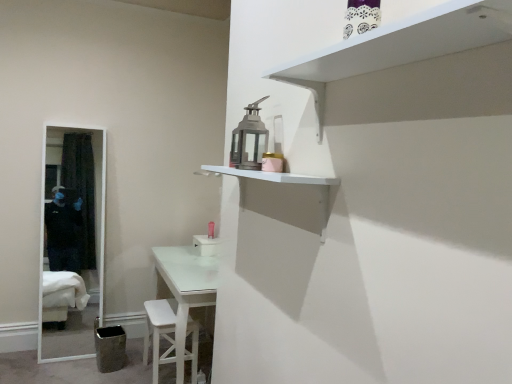
Question: Is white matte shelf at upper right, acting as the second shelf starting from the bottom, positioned in front of pink matte toiletry at center?

Choices:
 (A) yes
 (B) no

Answer: (A)

Question: Can you confirm if white matte shelf at upper right, which is the 1th shelf in top-to-bottom order, is taller than pink matte toiletry at center?

Choices:
 (A) no
 (B) yes

Answer: (B)

Question: Considering the relative sizes of white matte shelf at upper right, acting as the second shelf starting from the bottom, and pink matte toiletry at center in the image provided, is white matte shelf at upper right, acting as the second shelf starting from the bottom, wider than pink matte toiletry at center?

Choices:
 (A) yes
 (B) no

Answer: (A)

Question: From the image's perspective, is white matte shelf at upper right, acting as the second shelf starting from the bottom, located beneath pink matte toiletry at center?

Choices:
 (A) no
 (B) yes

Answer: (A)

Question: Can you confirm if white matte shelf at upper right, which is the 1th shelf in top-to-bottom order, is bigger than pink matte toiletry at center?

Choices:
 (A) no
 (B) yes

Answer: (B)

Question: Considering the positions of point (307, 59) and point (200, 170), is point (307, 59) closer or farther from the camera than point (200, 170)?

Choices:
 (A) farther
 (B) closer

Answer: (B)

Question: Would you say white matte shelf at upper right, acting as the second shelf starting from the bottom, is inside or outside white matte shelf at upper center, placed as the second shelf when sorted from top to bottom?

Choices:
 (A) outside
 (B) inside

Answer: (A)

Question: From the image's perspective, relative to white matte shelf at upper center, placed as the 1th shelf when sorted from bottom to top, is white matte shelf at upper right, which is the 1th shelf in top-to-bottom order, above or below?

Choices:
 (A) above
 (B) below

Answer: (A)

Question: Considering the positions of white matte shelf at upper right, which is the 1th shelf in top-to-bottom order, and white matte shelf at upper center, placed as the second shelf when sorted from top to bottom, in the image, is white matte shelf at upper right, which is the 1th shelf in top-to-bottom order, taller or shorter than white matte shelf at upper center, placed as the second shelf when sorted from top to bottom,?

Choices:
 (A) short
 (B) tall

Answer: (A)

Question: Is pink matte toiletry at center spatially inside white wooden stool at lower center, or outside of it?

Choices:
 (A) inside
 (B) outside

Answer: (B)

Question: From the image's perspective, relative to white wooden stool at lower center, is pink matte toiletry at center above or below?

Choices:
 (A) below
 (B) above

Answer: (B)

Question: Is point (212, 223) closer or farther from the camera than point (164, 332)?

Choices:
 (A) closer
 (B) farther

Answer: (B)

Question: Is pink matte toiletry at center wider or thinner than white wooden stool at lower center?

Choices:
 (A) thin
 (B) wide

Answer: (A)

Question: Is pink matte toiletry at center bigger or smaller than white matte shelf at upper right, which is the 1th shelf in top-to-bottom order?

Choices:
 (A) big
 (B) small

Answer: (B)

Question: Is pink matte toiletry at center in front of or behind white matte shelf at upper right, acting as the second shelf starting from the bottom, in the image?

Choices:
 (A) front
 (B) behind

Answer: (B)